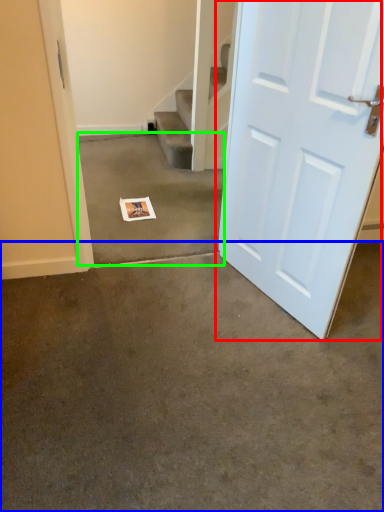
Question: Which object is positioned farthest from door (highlighted by a red box)? Select from concrete (highlighted by a blue box) and concrete (highlighted by a green box).

Choices:
 (A) concrete
 (B) concrete

Answer: (B)